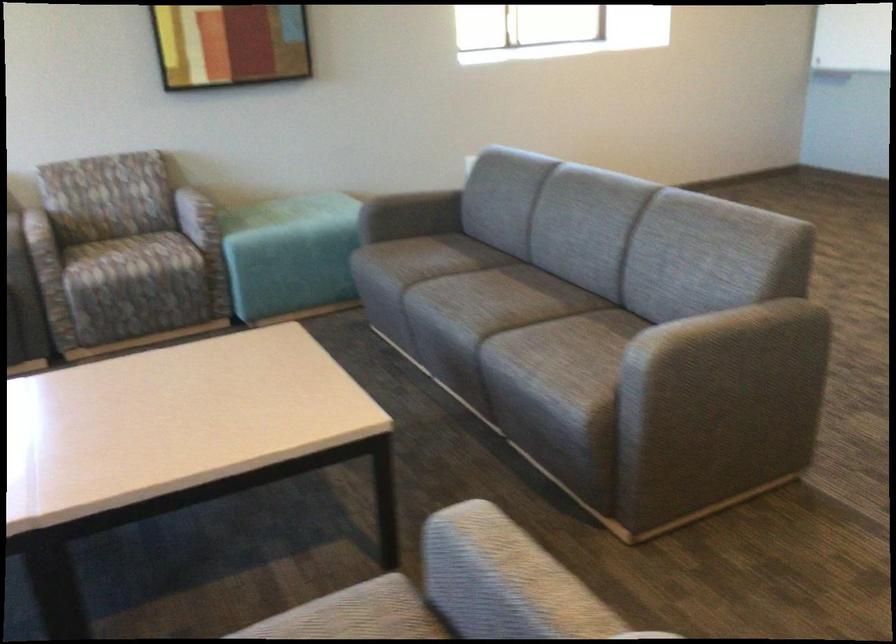
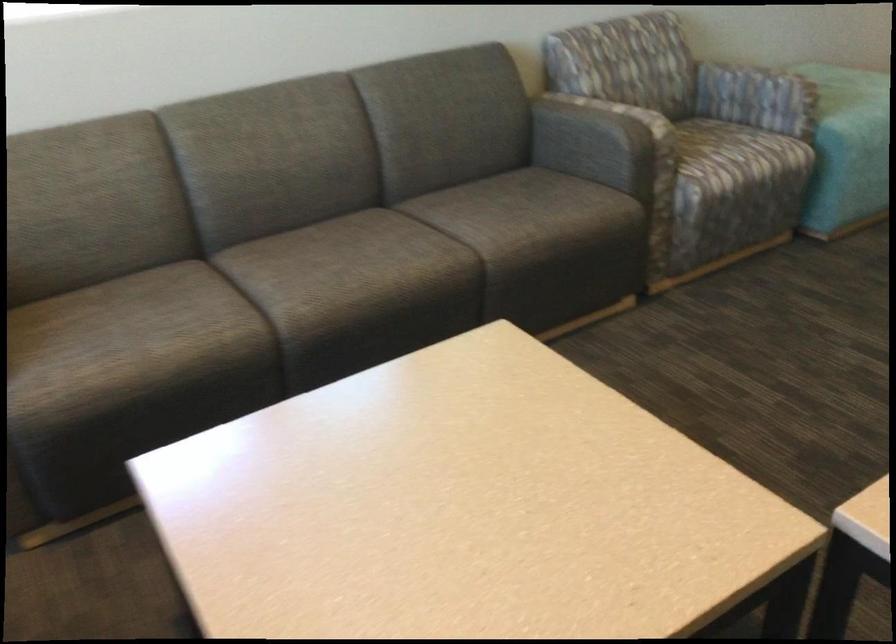
Question: I am providing you with two images of the same scene from different viewpoints. After the viewpoint changes to image2, which objects are now occluded?

Choices:
 (A) patterned chair armrest
 (B) floral pattern notebook
 (C) light blue ottoman
 (D) grey sofa armrest

Answer: (C)